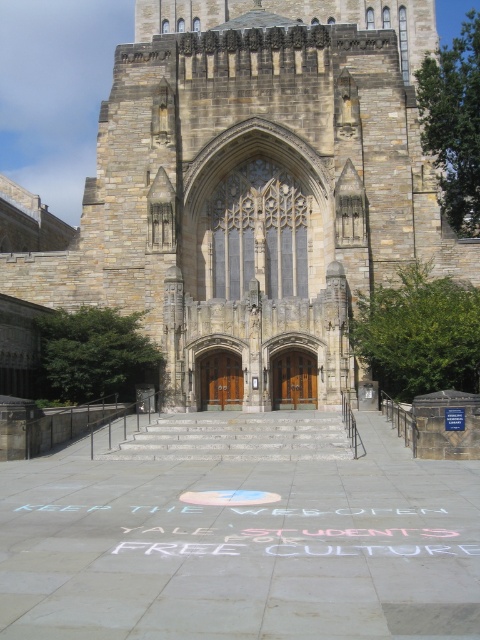
Question: Which point is farther to the camera?

Choices:
 (A) brown wooden door at center
 (B) white chalk writing at center
 (C) stone church at center
 (D) white concrete stairs at center

Answer: (A)

Question: Which of these objects is positioned closest to the white chalk writing at center?

Choices:
 (A) white concrete stairs at center
 (B) brown wooden doors at center

Answer: (A)

Question: Observing the image, what is the correct spatial positioning of brown wooden door at center in reference to brown wooden doors at center?

Choices:
 (A) below
 (B) above

Answer: (B)

Question: Estimate the real-world distances between objects in this image. Which object is farther from the brown wooden door at center?

Choices:
 (A) white concrete stairs at center
 (B) white chalk writing at center
 (C) stone church at center

Answer: (C)

Question: Is white chalk writing at center bigger than white concrete stairs at center?

Choices:
 (A) yes
 (B) no

Answer: (B)

Question: Is stone church at center bigger than white concrete stairs at center?

Choices:
 (A) no
 (B) yes

Answer: (B)